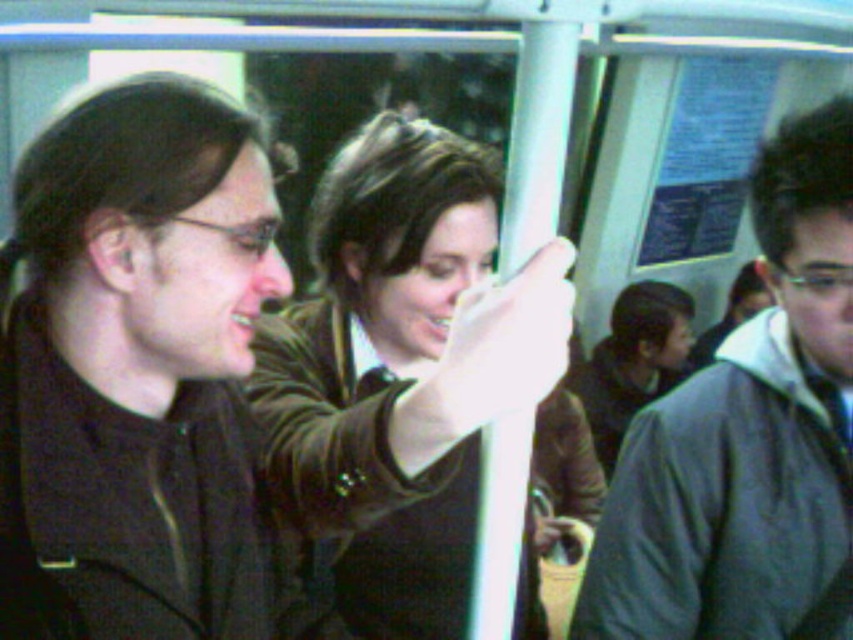
Between dark brown leather jacket at left and matte brown hair at center, which one has more height?

Standing taller between the two is matte brown hair at center.

Can you confirm if dark brown leather jacket at left is positioned to the left of matte brown hair at center?

Yes, dark brown leather jacket at left is to the left of matte brown hair at center.

You are a GUI agent. You are given a task and a screenshot of the screen. Output one action in this format:
    pyautogui.click(x=<x>, y=<y>)
    Task: Click on the dark brown leather jacket at left
    
    Given the screenshot: What is the action you would take?
    pyautogui.click(x=136, y=369)

Does dark brown leather jacket at left come in front of gray fabric jacket at right?

Yes, it is in front of gray fabric jacket at right.

The image size is (853, 640). Describe the element at coordinates (136, 369) in the screenshot. I see `dark brown leather jacket at left` at that location.

Is point (125, 564) positioned behind point (637, 451)?

That is False.

Image resolution: width=853 pixels, height=640 pixels. I want to click on dark brown leather jacket at left, so click(136, 369).

Measure the distance between brown leather jacket at center and gray fabric jacket at right.

brown leather jacket at center and gray fabric jacket at right are 10.92 inches apart from each other.

Between brown leather jacket at center and gray fabric jacket at right, which one has more height?

brown leather jacket at center

In order to click on brown leather jacket at center in this screenshot , I will do `click(398, 380)`.